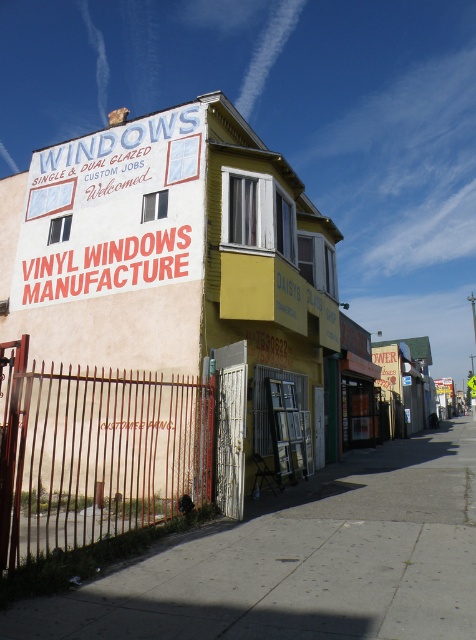
Question: Does beige painted wall at center appear over rusty metal gate at lower left?

Choices:
 (A) no
 (B) yes

Answer: (B)

Question: Can you confirm if beige painted wall at center is positioned to the left of concrete sidewalk at lower center?

Choices:
 (A) no
 (B) yes

Answer: (B)

Question: Which object is closer to the camera taking this photo?

Choices:
 (A) concrete sidewalk at lower center
 (B) rusty metal gate at lower left
 (C) white vinyl sign at upper center
 (D) beige painted wall at center

Answer: (A)

Question: Can you confirm if concrete sidewalk at lower center is positioned to the right of rusty metal gate at lower left?

Choices:
 (A) no
 (B) yes

Answer: (B)

Question: Which of the following is the closest to the observer?

Choices:
 (A) rusty metal gate at lower left
 (B) white vinyl sign at upper center

Answer: (A)

Question: Estimate the real-world distances between objects in this image. Which object is closer to the beige painted wall at center?

Choices:
 (A) concrete sidewalk at lower center
 (B) white vinyl sign at upper center

Answer: (B)